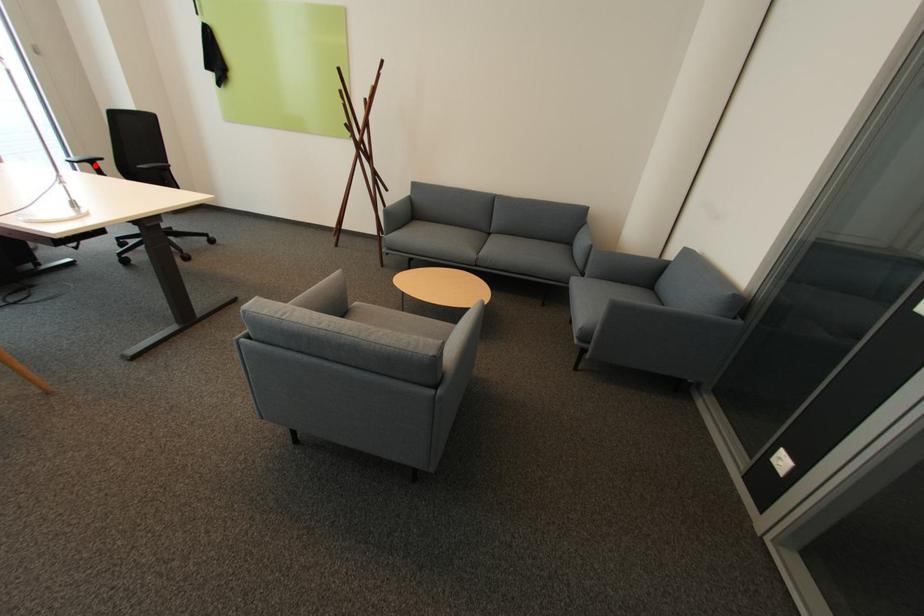
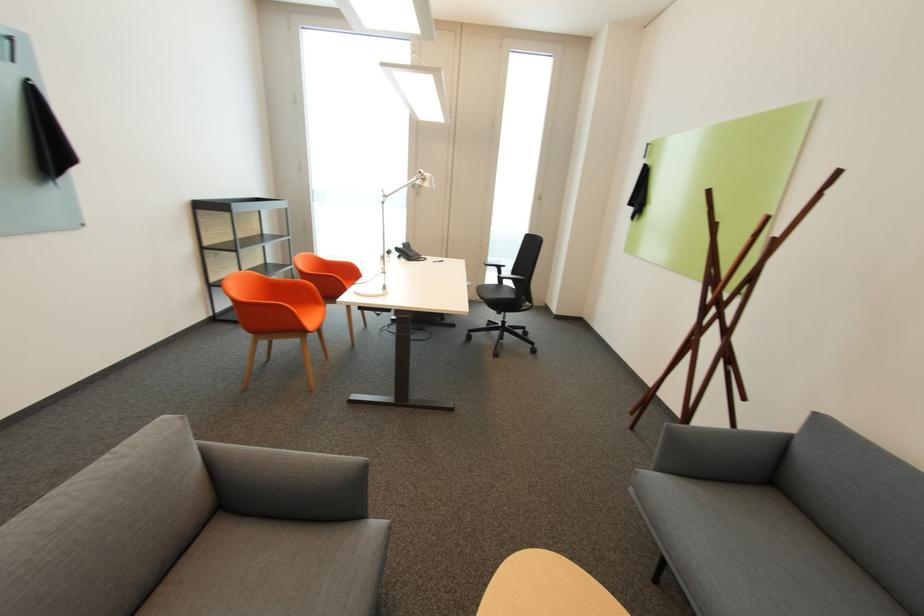
The point at the highlighted location is marked in the first image. Where is the corresponding point in the second image?

(503, 269)